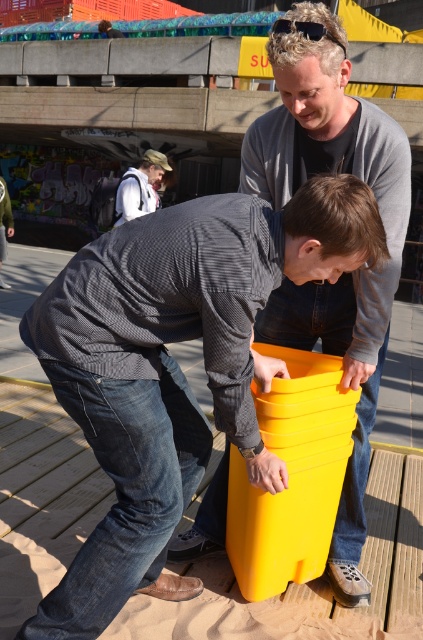
Can you confirm if matte yellow bucket at center is smaller than matte yellow plastic bucket at center?

Yes.

Which is behind, point (313, 273) or point (343, 550)?

The point (343, 550) is behind.

You are a GUI agent. You are given a task and a screenshot of the screen. Output one action in this format:
    pyautogui.click(x=<x>, y=<y>)
    Task: Click on the matte yellow bucket at center
    The image size is (423, 640).
    Given the screenshot: What is the action you would take?
    pyautogui.click(x=175, y=365)

Does matte yellow bucket at center have a greater height compared to white cotton shirt at upper left?

Yes.

Does matte yellow bucket at center come in front of white cotton shirt at upper left?

Yes.

Does point (123, 336) come in front of point (142, 164)?

Yes, point (123, 336) is closer to viewer.

This screenshot has width=423, height=640. In order to click on matte yellow bucket at center in this screenshot , I will do `click(175, 365)`.

Between matte yellow plastic bucket at center and white cotton shirt at upper left, which one is positioned higher?

Positioned higher is white cotton shirt at upper left.

Who is positioned more to the left, matte yellow plastic bucket at center or white cotton shirt at upper left?

white cotton shirt at upper left

This screenshot has height=640, width=423. What do you see at coordinates (343, 275) in the screenshot? I see `matte yellow plastic bucket at center` at bounding box center [343, 275].

Where is `matte yellow plastic bucket at center`? matte yellow plastic bucket at center is located at coordinates (343, 275).